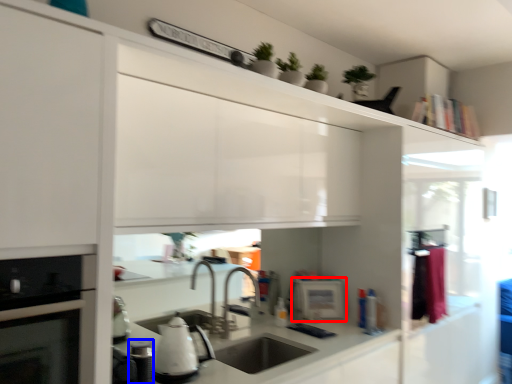
Question: Which object is closer to the camera taking this photo, appliance (highlighted by a red box) or appliance (highlighted by a blue box)?

Choices:
 (A) appliance
 (B) appliance

Answer: (B)